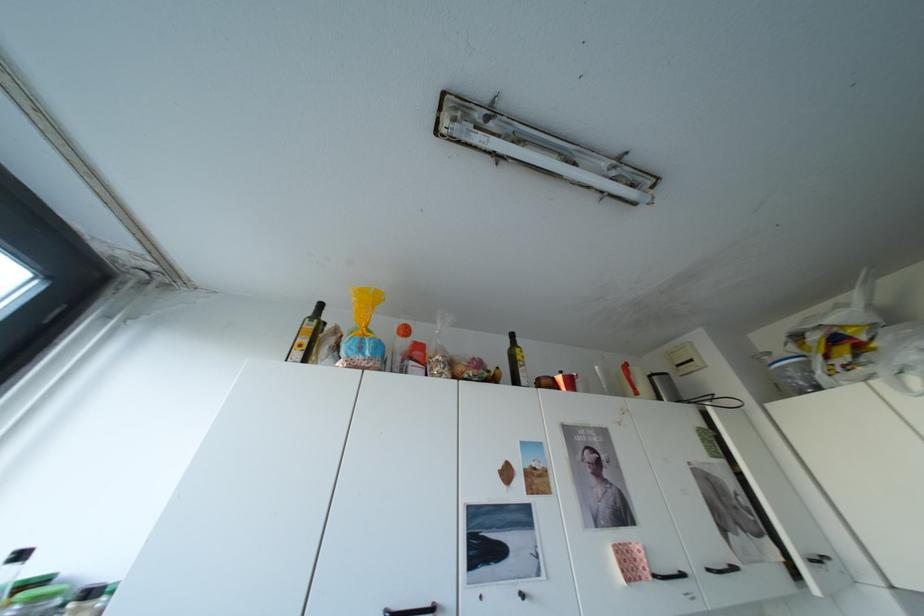
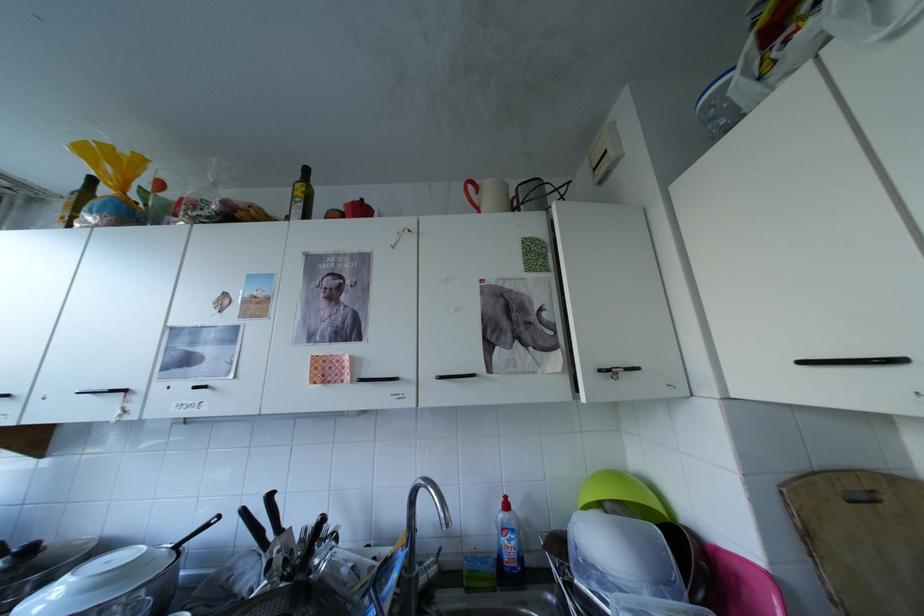
Find the pixel in the second image that matches (531,358) in the first image.

(309, 193)